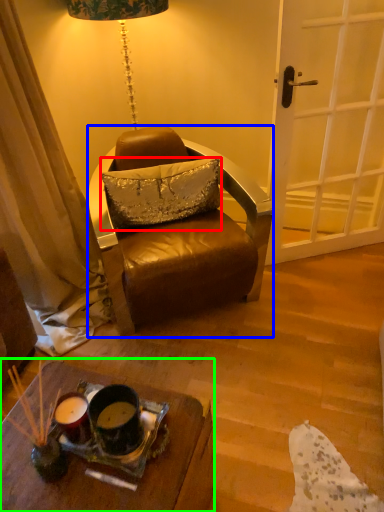
Question: Which is nearer to the pillow (highlighted by a red box)? chair (highlighted by a blue box) or desk (highlighted by a green box).

Choices:
 (A) chair
 (B) desk

Answer: (A)